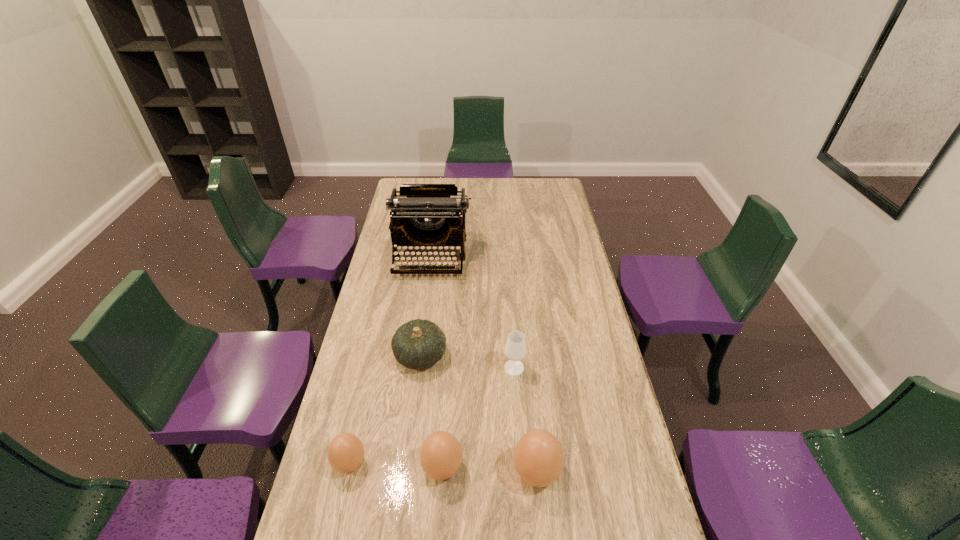
The height and width of the screenshot is (540, 960). I want to click on the shortest object, so click(x=345, y=453).

Find the location of `the leftmost boiled egg`. the leftmost boiled egg is located at coordinates (345, 453).

The width and height of the screenshot is (960, 540). I want to click on the second tallest boiled egg, so click(440, 455).

In order to click on the rightmost boiled egg in this screenshot , I will do `click(538, 457)`.

Find the location of a particular element. This screenshot has height=540, width=960. the farthest object is located at coordinates (423, 215).

Identify the location of the tallest object. (423, 215).

Where is `glass`? This screenshot has width=960, height=540. glass is located at coordinates (515, 350).

Image resolution: width=960 pixels, height=540 pixels. I want to click on gourd, so coord(418,344).

I want to click on vacant region located on the right of the shortest boiled egg, so [x=417, y=463].

Locate an element on the screen. free spot located on the back of the second boiled egg from left to right is located at coordinates (449, 358).